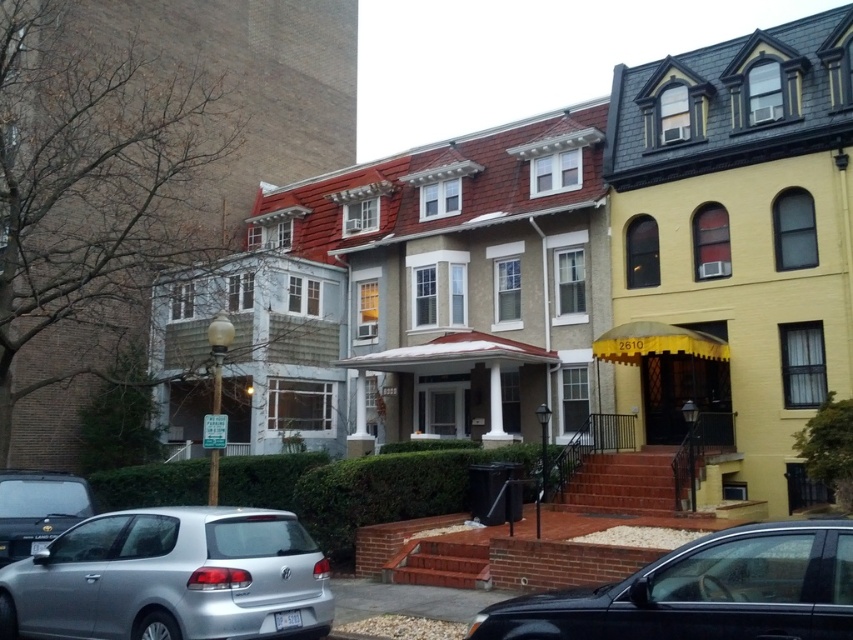
You are a delivery driver who needs to park a 2.5 meter wide truck in this area. You see the silver metallic hatchback at lower left and the shiny black sedan at lower center. Which vehicle has enough space to allow the truck to park between them?

The silver metallic hatchback at lower left has a larger width than the shiny black sedan at lower center, so the truck can park between the silver metallic hatchback at lower left and the shiny black sedan at lower center if there is sufficient space between them. However, the question specifies parking the truck between them, but the width comparison alone doesn not confirm the total space available between the two vehicles. More information about the distance between them is needed.

You are standing on the sidewalk in front of the row of houses. You want to throw a ball to your friend who is standing at the point marked as point (624, 600). If your throwing distance is 5 meters, will you be able to reach them?

The point (624, 600) is 5.49 meters away from the viewer. Since your throwing distance is 5 meters, you will not be able to reach them.